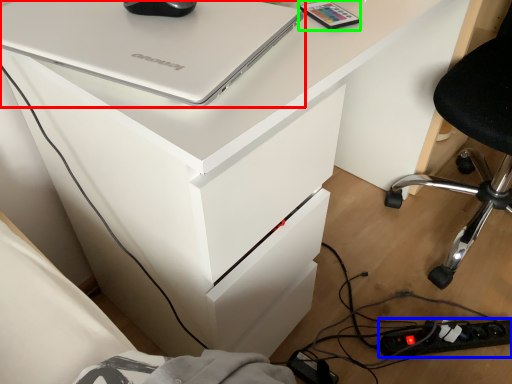
Question: Based on their relative distances, which object is nearer to laptop (highlighted by a red box)? Choose from extension cord (highlighted by a blue box) and equipment (highlighted by a green box).

Choices:
 (A) extension cord
 (B) equipment

Answer: (B)